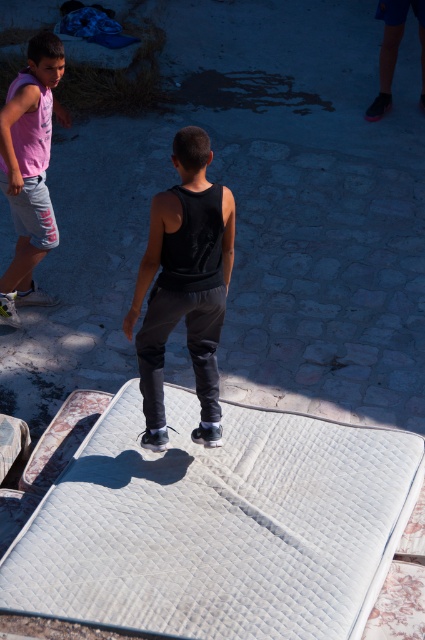
You are a delivery person who needs to transport the white quilted mattress at center and the black matte tank top at center in your truck. The truck has a loading area that is 1.2 meters wide. Can both items fit side by side without overlapping?

The white quilted mattress at center might be wider than black matte tank top at center. Since the mattress might be wider than the tank top, but we don not know their exact widths, it is uncertain if both can fit side by side in the 1.2 meters wide loading area. Further measurements are needed.